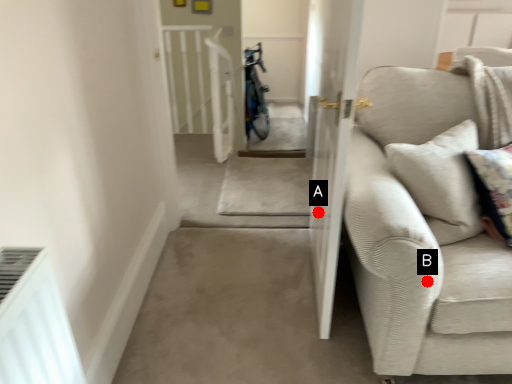
Question: Two points are circled on the image, labeled by A and B beside each circle. Among these points, which one is farthest from the camera?

Choices:
 (A) A is further
 (B) B is further

Answer: (A)